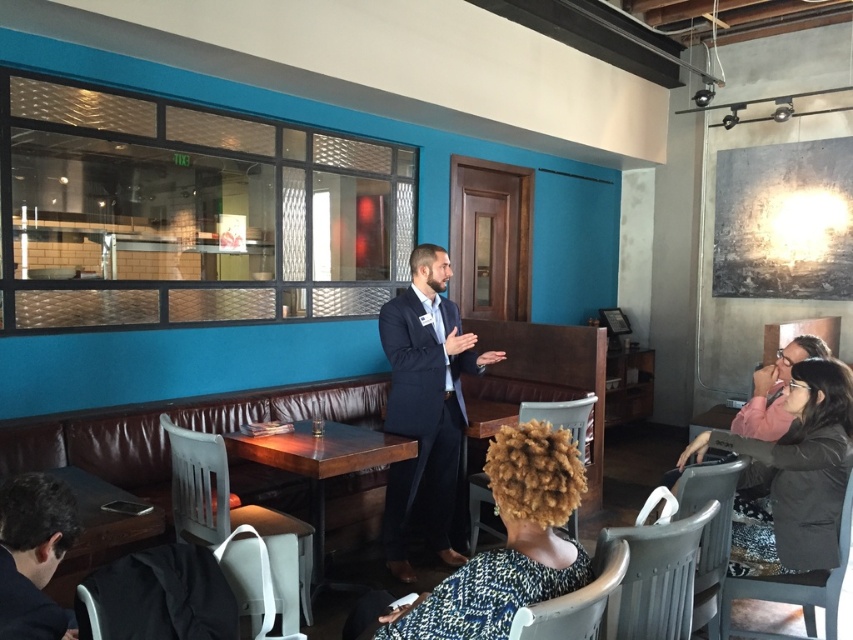
You are standing in the cafe and want to take a photo of both the point at coordinates [846,413] and the point at coordinates [74,628]. Which point should you focus on first to ensure both are in focus?

You should focus on the point at coordinates [846,413] first because it is closer to the camera than the point at coordinates [74,628]. This ensures that both points will be in focus when using a camera with a fixed focal plane.

You are standing in the cafe and see the black matte jacket at lower right. Where exactly is it located in the room?

The black matte jacket at lower right is located at point (791, 476) in the room.